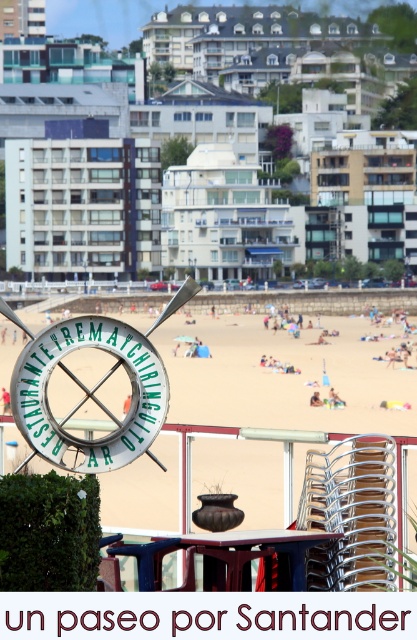
You are standing at point [226,435] on a map of the beach scene. What material are you standing on?

The point [226,435] is on beige sand at center, so you are standing on beige sand.

You are standing at the beach and want to reach the point marked as point (120, 422). If you walk straight ahead, will you reach that point before walking 50 meters?

The point (120, 422) is 53.35 meters away from the viewer. Since 53.35 meters is greater than 50 meters, you will not reach the point before walking 50 meters.